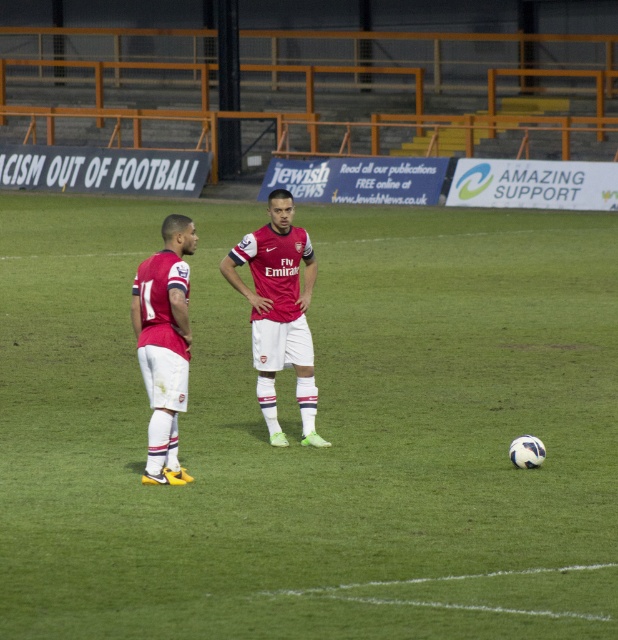
Which of these two, matte red jersey at center or matte red jersey at left, stands shorter?

matte red jersey at left is shorter.

Who is lower down, matte red jersey at center or matte red jersey at left?

matte red jersey at left

Which is in front, point (302, 241) or point (158, 356)?

Positioned in front is point (158, 356).

Find the location of `matte red jersey at center`. matte red jersey at center is located at coordinates (277, 310).

How distant is white smooth soccer ball at center from matte red jersey at center?

white smooth soccer ball at center and matte red jersey at center are 21.63 feet apart.

Does white smooth soccer ball at center appear on the right side of matte red jersey at center?

Yes, white smooth soccer ball at center is to the right of matte red jersey at center.

Does point (501, 524) come in front of point (256, 400)?

That is True.

At what (x,y) coordinates should I click in order to perform the action: click on white smooth soccer ball at center. Please return your answer as a coordinate pair (x, y). Looking at the image, I should click on (316, 428).

Is point (459, 420) positioned before point (179, 241)?

No, it is behind (179, 241).

Identify the location of white smooth soccer ball at center. (316, 428).

I want to click on white smooth soccer ball at center, so click(316, 428).